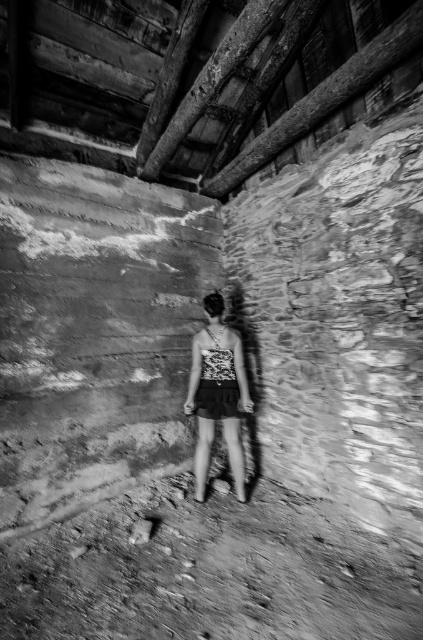
Which is behind, point (246, 566) or point (214, 420)?

Point (214, 420)

Is point (35, 628) in front of point (195, 483)?

Yes, it is.

Locate an element on the screen. This screenshot has height=640, width=423. dirt track at lower center is located at coordinates (208, 572).